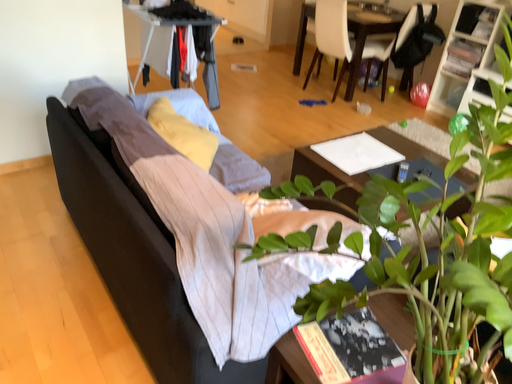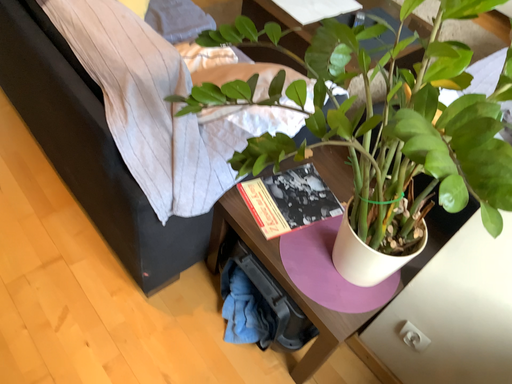
Question: How did the camera likely rotate when shooting the video?

Choices:
 (A) rotated downward
 (B) rotated upward

Answer: (A)